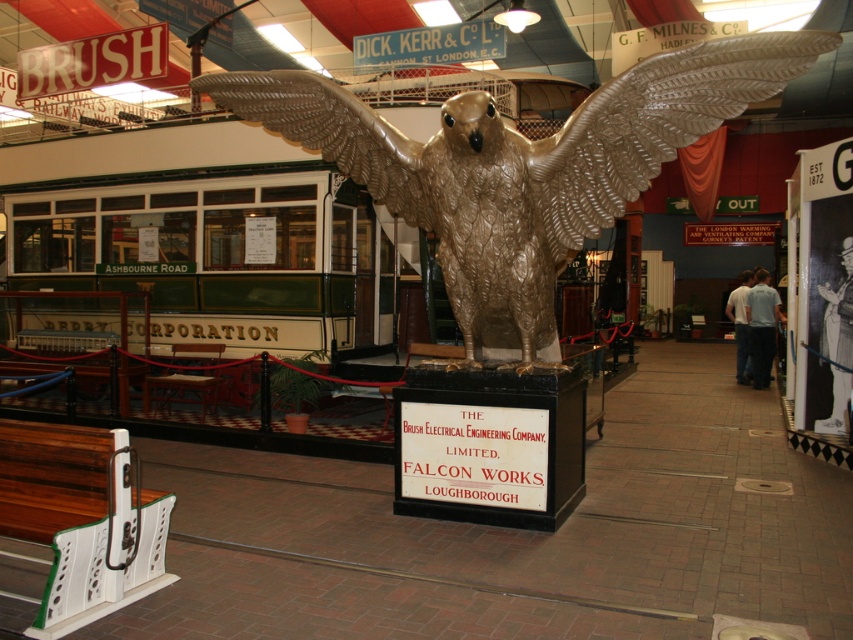
You are standing in the museum and see two points marked in the image. The first point is at coordinate (711, 120) and the second point is at coordinate (283, 108). Which point is closer to you?

Point (711, 120) is closer to the viewer than point (283, 108).

You are an art curator planning to install a protective glass case around the gold metallic eagle at center and the metallic gold wing at center. The case must accommodate both objects. Based on the scene description, which object requires more space in the case?

The gold metallic eagle at center requires more space in the case because it is bigger than the metallic gold wing at center.

You are an art curator planning to install a new lighting fixture above the gold metallic eagle at center and the gold metallic wing at upper center. The fixture must be placed equidistant from both objects. Given their heights, which object should the light be positioned closer to?

The gold metallic eagle at center is taller than the gold metallic wing at upper center, so the light should be positioned closer to the gold metallic wing at upper center to maintain equal distance from both objects.